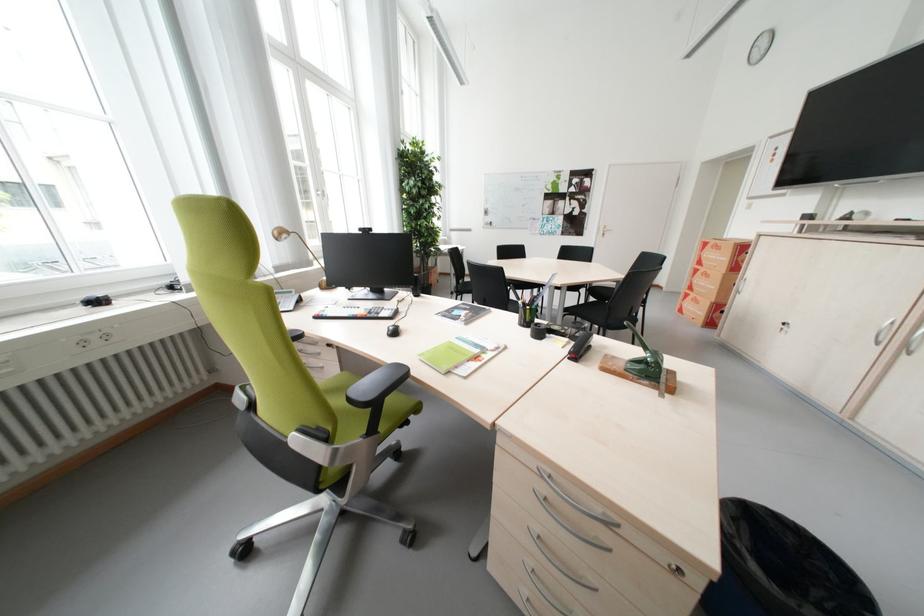
Identify the location of drawer keyhole. This screenshot has height=616, width=924. (104, 336).